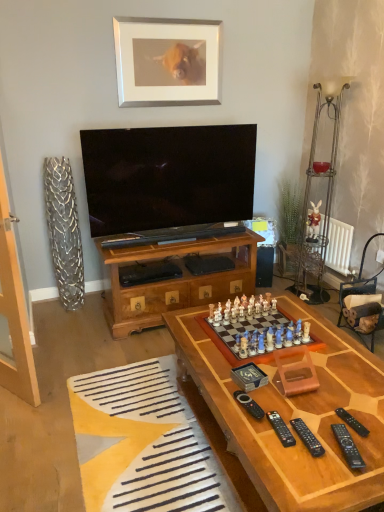
You are a GUI agent. You are given a task and a screenshot of the screen. Output one action in this format:
    pyautogui.click(x=<x>, y=<y>)
    Task: Click on the vacant region to the left of black plastic remote at lower right, the fourth remote when ordered from left to right
    The width and height of the screenshot is (384, 512).
    Given the screenshot: What is the action you would take?
    click(297, 456)